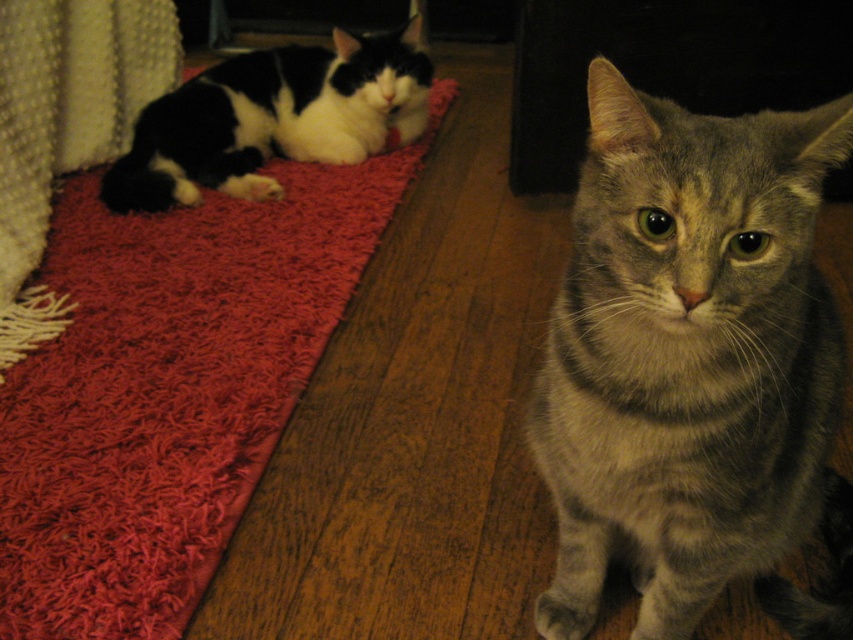
Question: Which point is closer to the camera?

Choices:
 (A) (254, 444)
 (B) (158, 193)

Answer: (A)

Question: Does red shaggy rug at upper left have a lesser width compared to black and white fur cat at upper left?

Choices:
 (A) no
 (B) yes

Answer: (A)

Question: Which of the following is the closest to the observer?

Choices:
 (A) black and white fur cat at upper left
 (B) gray striped cat at center

Answer: (B)

Question: Is gray striped cat at center positioned behind black and white fur cat at upper left?

Choices:
 (A) no
 (B) yes

Answer: (A)

Question: Which point is farther to the camera?

Choices:
 (A) black and white fur cat at upper left
 (B) red shaggy rug at upper left
 (C) gray striped cat at center

Answer: (A)

Question: Where is red shaggy rug at upper left located in relation to black and white fur cat at upper left in the image?

Choices:
 (A) below
 (B) above

Answer: (A)